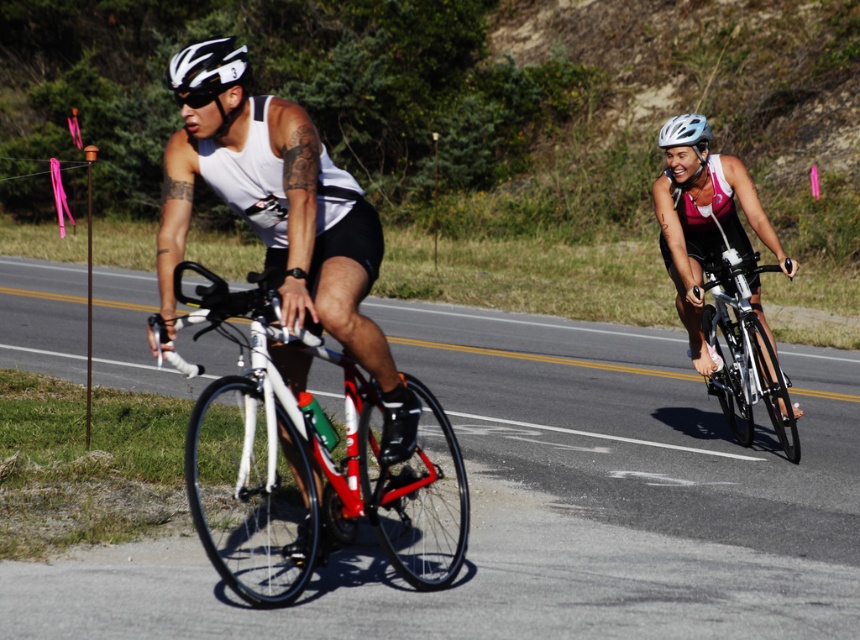
Question: Can you confirm if matte white tank top at center is positioned to the left of matte pink tri suit at right?

Choices:
 (A) yes
 (B) no

Answer: (A)

Question: Which point is farther to the camera?

Choices:
 (A) (292, 125)
 (B) (698, 134)
 (C) (677, 134)

Answer: (C)

Question: Can you confirm if shiny white frame at center is positioned to the right of white matte helmet at upper right?

Choices:
 (A) yes
 (B) no

Answer: (B)

Question: Among these objects, which one is farthest from the camera?

Choices:
 (A) silver metallic bicycle at right
 (B) matte white tank top at center
 (C) white matte helmet at upper right

Answer: (C)

Question: Based on their relative distances, which object is nearer to the white matte helmet at upper right?

Choices:
 (A) matte pink tri suit at right
 (B) white matte bicycle helmet at upper left

Answer: (A)

Question: Is silver metallic bicycle at right above white matte bicycle helmet at upper left?

Choices:
 (A) no
 (B) yes

Answer: (A)